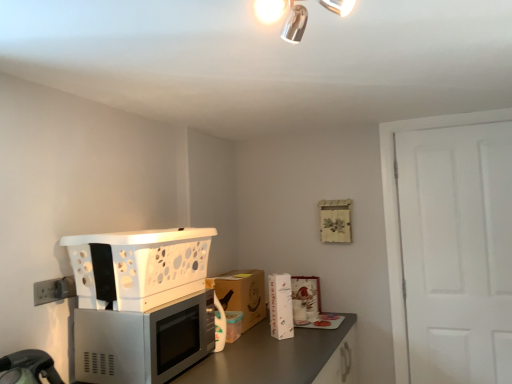
You are a GUI agent. You are given a task and a screenshot of the screen. Output one action in this format:
    pyautogui.click(x=<x>, y=<y>)
    Task: Click on the vacant space in front of white glossy refrigerator at center, which ranks as the 1th appliance in left-to-right order
    This screenshot has height=384, width=512.
    Given the screenshot: What is the action you would take?
    pyautogui.click(x=284, y=342)